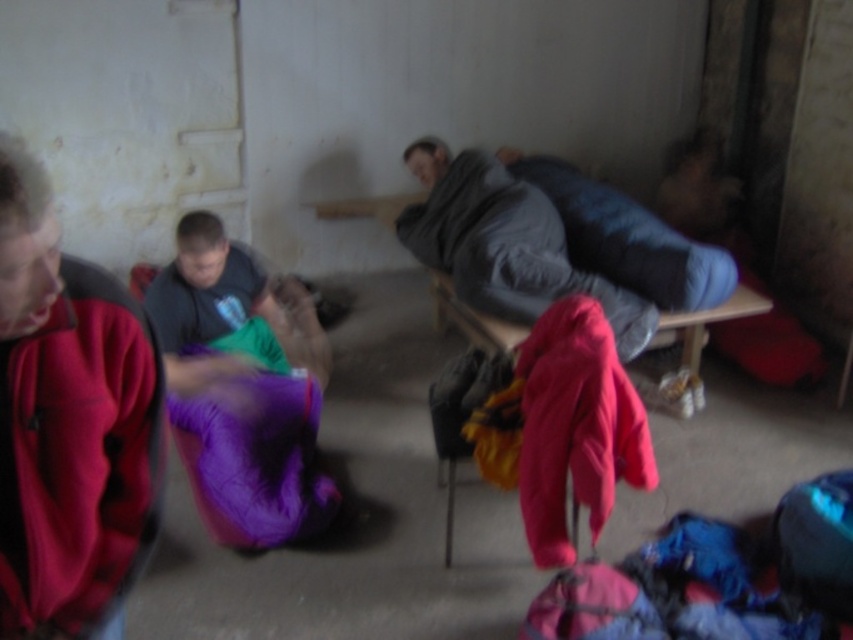
Question: Which point is farther from the camera taking this photo?

Choices:
 (A) (30, 259)
 (B) (566, 257)

Answer: (B)

Question: Which point is closer to the camera taking this photo?

Choices:
 (A) (74, 579)
 (B) (444, 205)

Answer: (A)

Question: Is red fleece jacket at left to the left of dark gray fabric sleeping bag at center from the viewer's perspective?

Choices:
 (A) no
 (B) yes

Answer: (B)

Question: Can you confirm if red fleece jacket at left is smaller than dark gray fabric sleeping bag at center?

Choices:
 (A) yes
 (B) no

Answer: (A)

Question: Can you confirm if red fleece jacket at left is positioned above dark gray fabric sleeping bag at center?

Choices:
 (A) no
 (B) yes

Answer: (A)

Question: Which of the following is the farthest from the observer?

Choices:
 (A) (96, 353)
 (B) (474, 237)

Answer: (B)